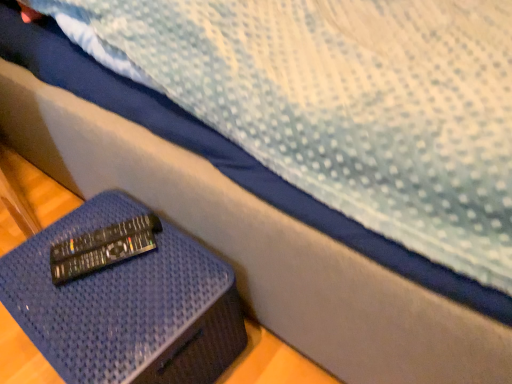
Image resolution: width=512 pixels, height=384 pixels. Identify the location of vacant point to the right of black plastic remote at lower left, which is the first remote from front to back. (175, 269).